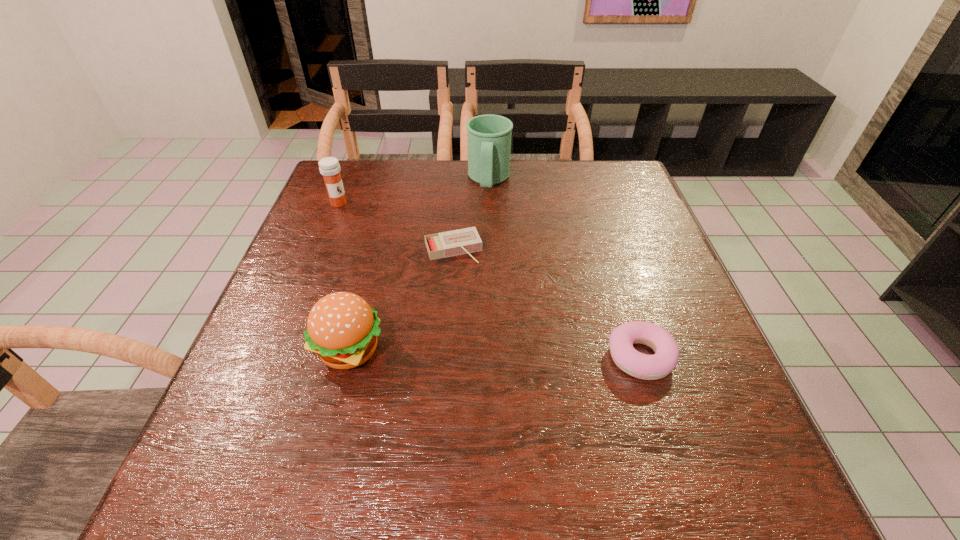
This screenshot has height=540, width=960. In order to click on vacant region between the tallest object and the third farthest object in this screenshot , I will do `click(471, 214)`.

Identify which object is located as the second nearest to the rightmost object. Please provide its 2D coordinates. Your answer should be formatted as a tuple, i.e. [(x, y)], where the tuple contains the x and y coordinates of a point satisfying the conditions above.

[(342, 328)]

Select which object appears as the closest to the pastry. Please provide its 2D coordinates. Your answer should be formatted as a tuple, i.e. [(x, y)], where the tuple contains the x and y coordinates of a point satisfying the conditions above.

[(462, 241)]

The width and height of the screenshot is (960, 540). Find the location of `vacant space that satisfies the following two spatial constraints: 1. on the back side of the tallest object; 2. on the right side of the leftmost object`. vacant space that satisfies the following two spatial constraints: 1. on the back side of the tallest object; 2. on the right side of the leftmost object is located at coordinates coord(348,180).

In order to click on free space in the image that satisfies the following two spatial constraints: 1. on the front side of the shortest object; 2. on the right side of the leftmost object in this screenshot , I will do `click(321, 249)`.